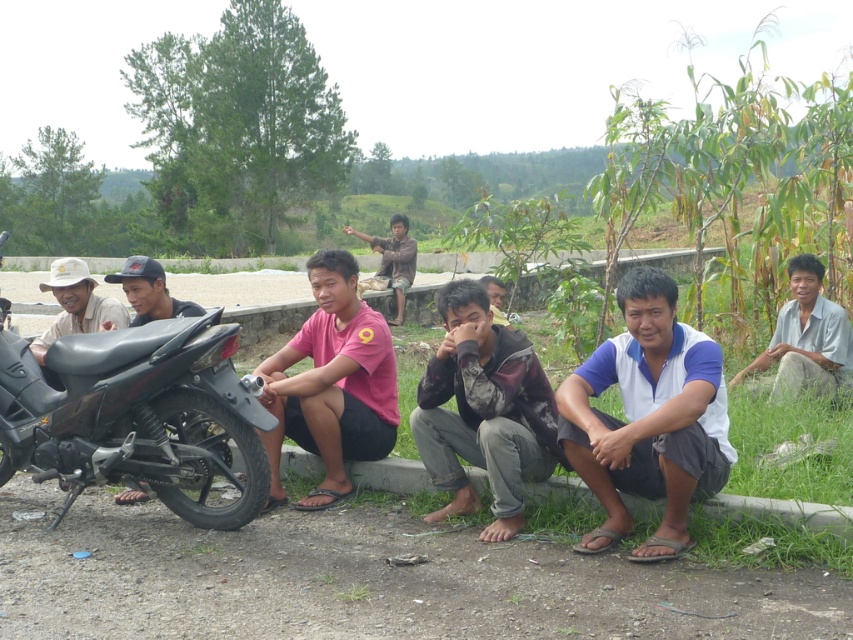
You are standing at the edge of the dirt road and want to locate the white cotton shirt at center. According to the coordinates provided, in which direction should you look relative to your position?

You should look towards the center of the image, as the white cotton shirt at center is located at coordinates point (648, 419), which corresponds to the central area.

You are a photographer trying to capture a group photo of the seven people sitting on the concrete ledge. You need to ensure that both the black matte motorcycle at left and the brown cotton shirt at center are visible in the frame. Given their sizes, which object should you position closer to the camera to ensure both are fully visible?

The black matte motorcycle at left is shorter than the brown cotton shirt at center. To ensure both are fully visible in the frame, position the brown cotton shirt at center closer to the camera since it is taller and might be partially obscured if placed farther away.

You are a photographer trying to capture a photo of the white cotton shirt at center and the gray cotton shirt at lower right. Based on their positions, which shirt should you focus on first to ensure both are in frame?

The white cotton shirt at center is below the gray cotton shirt at lower right, so you should focus on the gray cotton shirt at lower right first to ensure both are in frame.